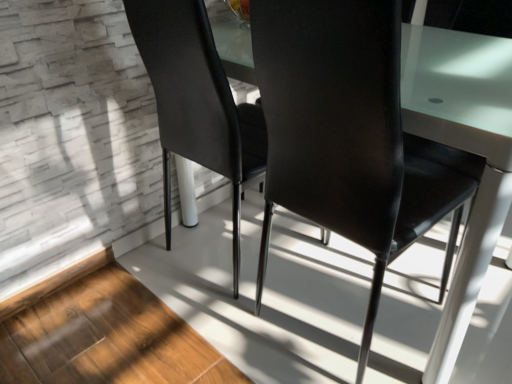
Locate an element on the screen. The height and width of the screenshot is (384, 512). vacant region to the left of matte black chair at center, the 1th chair in the left-to-right sequence is located at coordinates (120, 286).